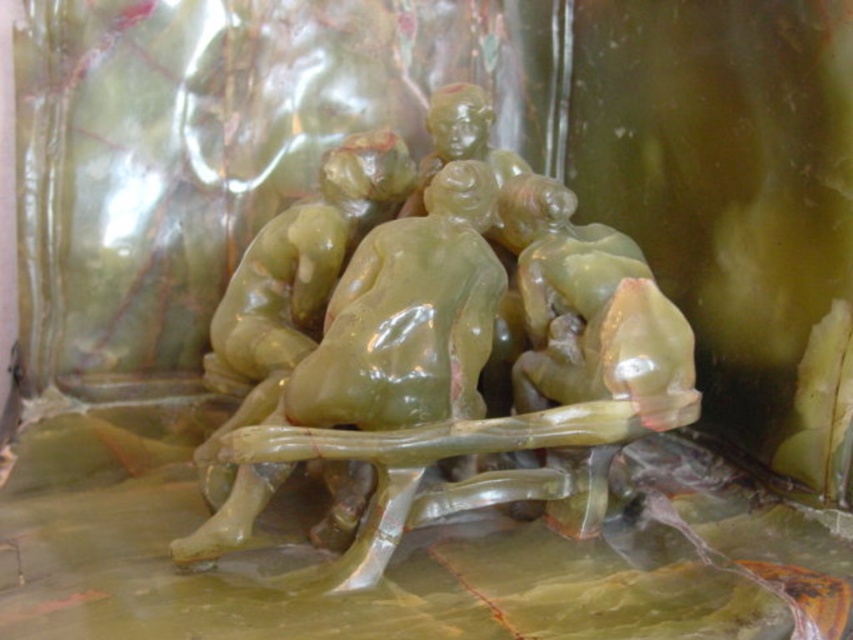
Which statue is wider, the green translucent statue at center or the green polished stone statue at center?

The green translucent statue at center is wider than the green polished stone statue at center according to the description.

You are an art curator planning to display both the green translucent statue at center and the green polished stone statue at center in a gallery. Given their sizes, which one should be placed in a larger exhibition space to accommodate its size?

The green translucent statue at center is bigger than the green polished stone statue at center, so it should be placed in a larger exhibition space to accommodate its size.

You are an art conservator trying to install a protective barrier around the green translucent statue at center. The barrier requires a minimum of 36 inches between the statue and any other object to function properly. Based on the description, is the current spacing sufficient?

The objects are 34.46 inches apart, which is less than the required 36 inches. Therefore, the current spacing is insufficient for the protective barrier to function properly.